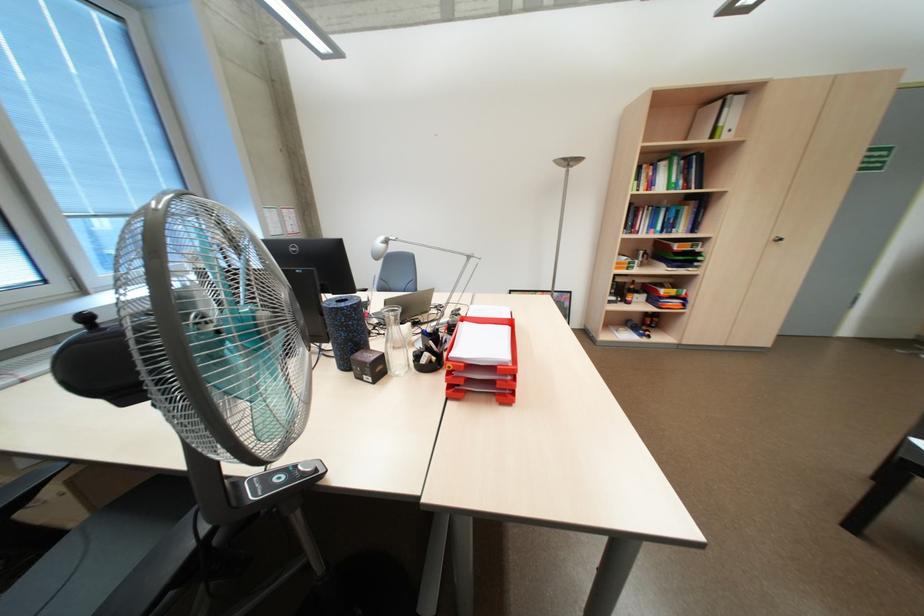
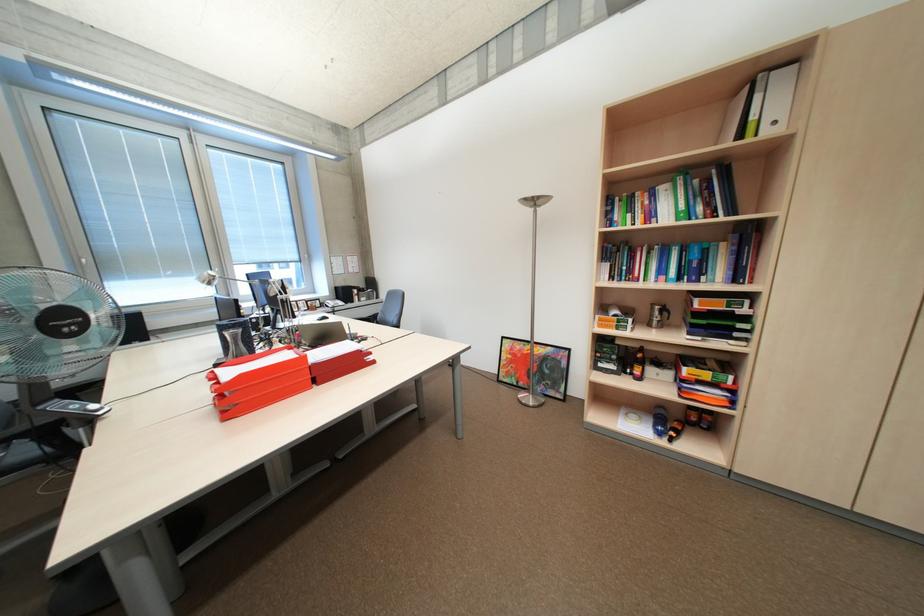
Question: I am providing you with two images of the same scene from different viewpoints. Which of the following objects are not visible in image2?

Choices:
 (A) book
 (B) white binder
 (C) clear glass bottle
 (D) small brown jar

Answer: (C)